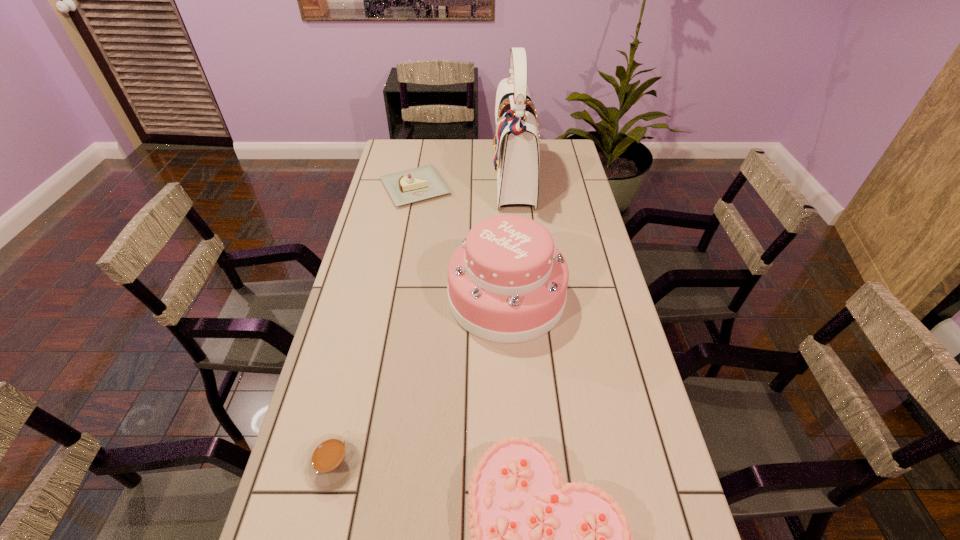
Locate an element on the screen. vacant point located between the leftmost cake and the cappuccino is located at coordinates (374, 326).

You are a GUI agent. You are given a task and a screenshot of the screen. Output one action in this format:
    pyautogui.click(x=<x>, y=<y>)
    Task: Click on the empty location between the shortest cake and the fourth shortest object
    The width and height of the screenshot is (960, 540).
    Given the screenshot: What is the action you would take?
    pyautogui.click(x=461, y=242)

Where is `free space between the cappuccino and the tallest object`? The height and width of the screenshot is (540, 960). free space between the cappuccino and the tallest object is located at coordinates (424, 322).

Find the location of `free spot between the shortest cake and the second nearest cake`. free spot between the shortest cake and the second nearest cake is located at coordinates (461, 242).

Locate which object is the closest to the farthest cake. Please provide its 2D coordinates. Your answer should be formatted as a tuple, i.e. [(x, y)], where the tuple contains the x and y coordinates of a point satisfying the conditions above.

[(516, 152)]

Locate an element on the screen. The width and height of the screenshot is (960, 540). object that is the third nearest to the cappuccino is located at coordinates (404, 187).

Locate an element on the screen. The height and width of the screenshot is (540, 960). cake that is the closest to the third tallest object is located at coordinates (507, 283).

You are a GUI agent. You are given a task and a screenshot of the screen. Output one action in this format:
    pyautogui.click(x=<x>, y=<y>)
    Task: Click on the second closest cake to the third farthest object
    The image size is (960, 540).
    Given the screenshot: What is the action you would take?
    pyautogui.click(x=534, y=539)

This screenshot has height=540, width=960. What are the coordinates of `vacant position in the image that satisfies the following two spatial constraints: 1. on the front-facing side of the satchel; 2. on the front side of the farthest cake` in the screenshot? It's located at (516, 187).